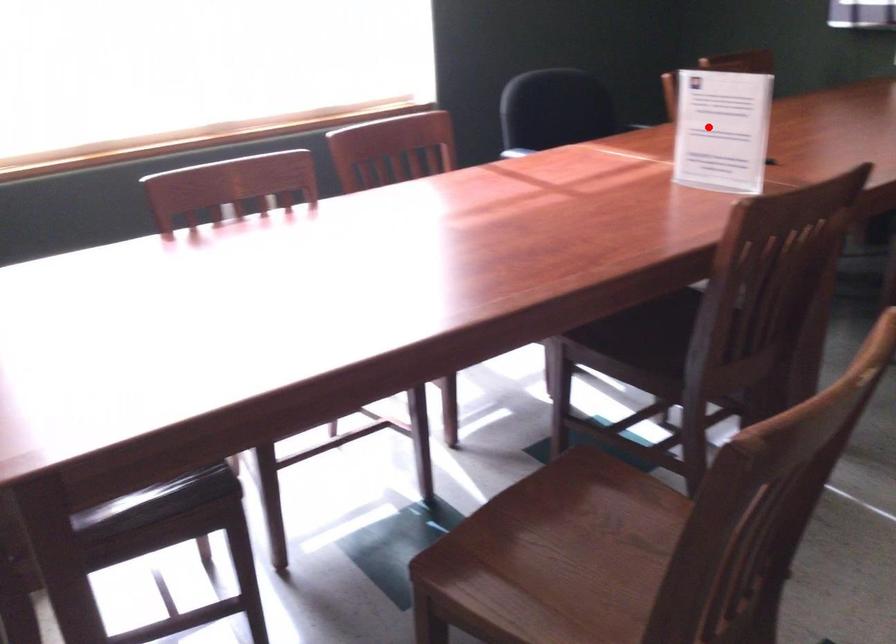
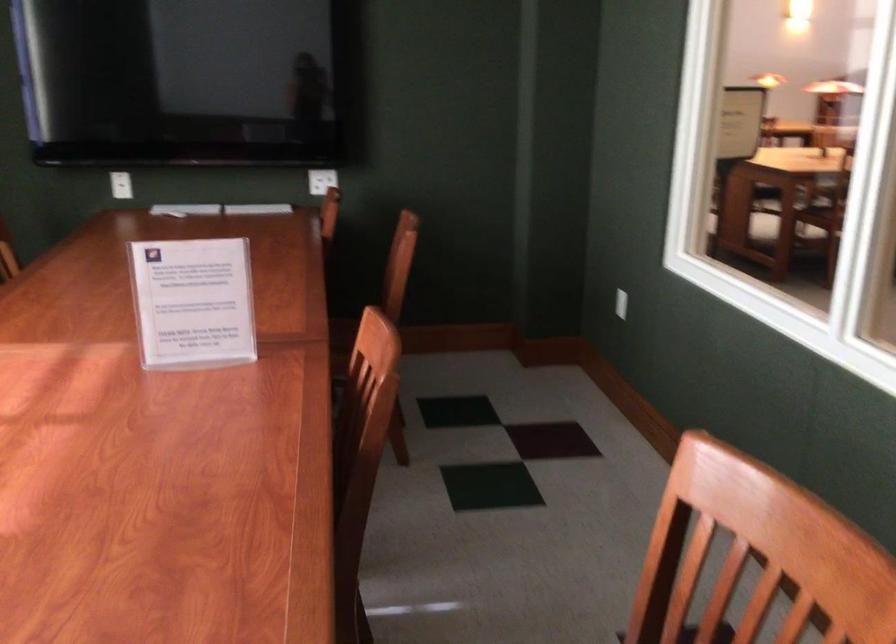
Question: I am providing you with two images of the same scene from different viewpoints. In image1, a red point is highlighted. Considering the same 3D point in image2, which of the following is correct?

Choices:
 (A) It is closer
 (B) It is farther

Answer: (A)